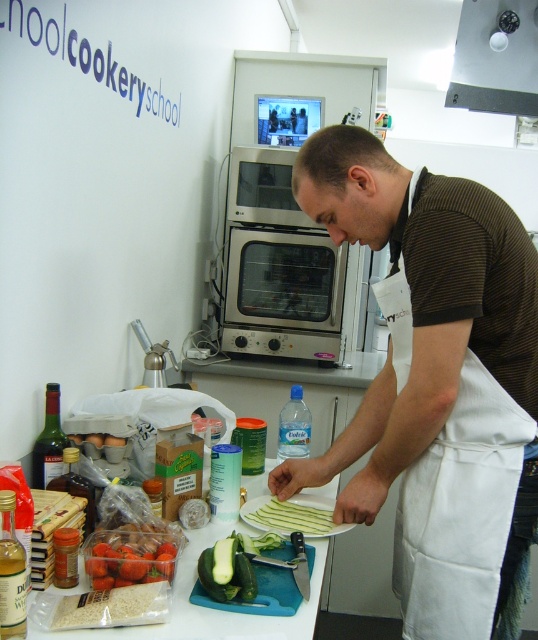
Does translucent glass bottle at center have a greater height compared to translucent glass bottle at left?

Indeed, translucent glass bottle at center has a greater height compared to translucent glass bottle at left.

Looking at this image, can you confirm if translucent glass bottle at center is bigger than translucent glass bottle at left?

No, translucent glass bottle at center is not bigger than translucent glass bottle at left.

Is point (17, 548) positioned before point (49, 486)?

That is True.

The width and height of the screenshot is (538, 640). What are the coordinates of `translucent glass bottle at center` in the screenshot? It's located at (10, 572).

Which is more to the left, white plastic cutting board at center or green matte cucumber at lower center?

From the viewer's perspective, white plastic cutting board at center appears more on the left side.

Can you confirm if white plastic cutting board at center is taller than green matte cucumber at lower center?

Yes.

This screenshot has width=538, height=640. What do you see at coordinates (208, 609) in the screenshot?
I see `white plastic cutting board at center` at bounding box center [208, 609].

Where is `white plastic cutting board at center`? This screenshot has height=640, width=538. white plastic cutting board at center is located at coordinates (208, 609).

Can you confirm if white plastic cutting board at center is wider than metallic gray exhaust hood at upper center?

Yes.

Between point (201, 545) and point (529, 97), which one is positioned behind?

Point (529, 97)

Between point (185, 595) and point (504, 88), which one is positioned in front?

Positioned in front is point (185, 595).

The height and width of the screenshot is (640, 538). Find the location of `white plastic cutting board at center`. white plastic cutting board at center is located at coordinates (208, 609).